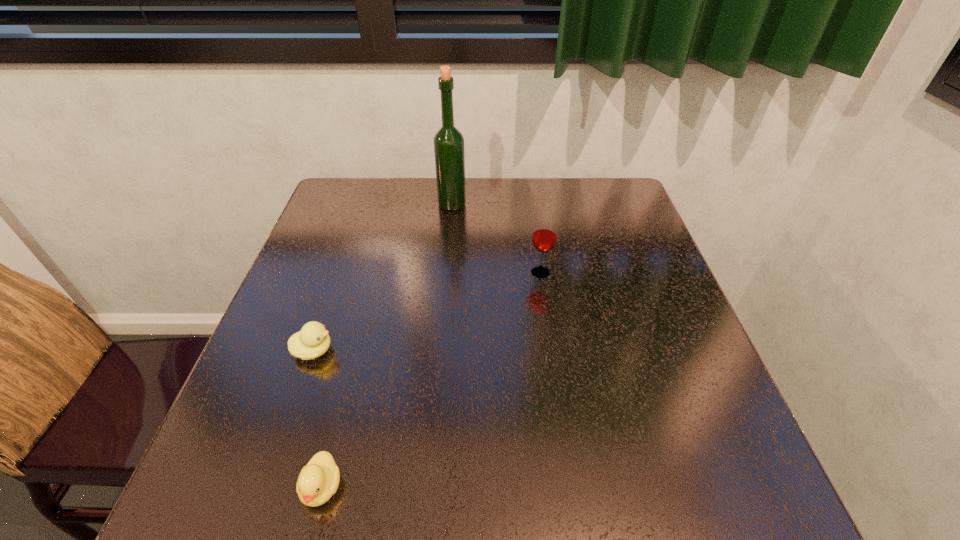
Locate an element on the screen. This screenshot has height=540, width=960. vacant area at the near right corner is located at coordinates (709, 510).

Identify the location of empty space that is in between the right duckling and the third shortest object. (x=431, y=380).

At what (x,y) coordinates should I click in order to perform the action: click on vacant area between the tallest object and the rightmost object. Please return your answer as a coordinate pair (x, y). Image resolution: width=960 pixels, height=540 pixels. Looking at the image, I should click on pyautogui.click(x=496, y=239).

This screenshot has width=960, height=540. I want to click on empty space that is in between the third nearest object and the second nearest object, so click(427, 312).

Find the location of a particular element. free spot between the right duckling and the left duckling is located at coordinates (318, 418).

This screenshot has width=960, height=540. I want to click on unoccupied area between the nearest object and the glass, so [x=431, y=380].

Find the location of a particular element. This screenshot has height=540, width=960. free space between the farthest object and the nearer duckling is located at coordinates (387, 346).

I want to click on free space that is in between the nearer duckling and the farthest object, so click(x=387, y=346).

The height and width of the screenshot is (540, 960). Find the location of `free space between the second farthest object and the left duckling`. free space between the second farthest object and the left duckling is located at coordinates (427, 312).

Where is `vacant space that is in between the liquor and the right duckling`? vacant space that is in between the liquor and the right duckling is located at coordinates (387, 346).